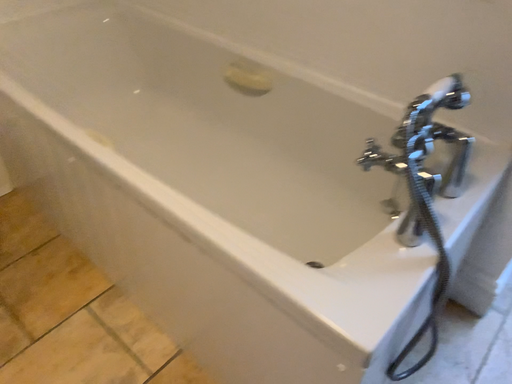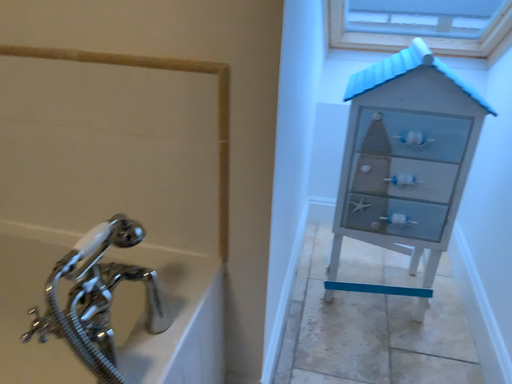
Question: How did the camera likely rotate when shooting the video?

Choices:
 (A) rotated left
 (B) rotated right

Answer: (B)